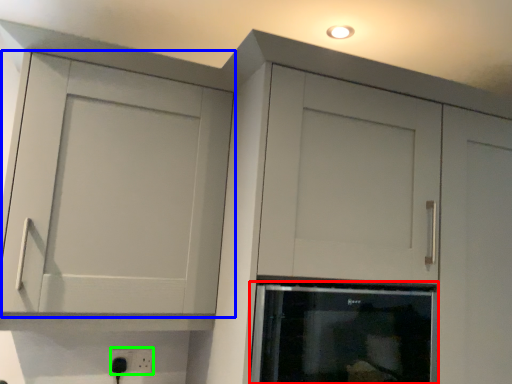
Question: Which object is positioned farthest from appliance (highlighted by a red box)? Select from cupboard (highlighted by a blue box) and electric outlet (highlighted by a green box).

Choices:
 (A) cupboard
 (B) electric outlet

Answer: (B)